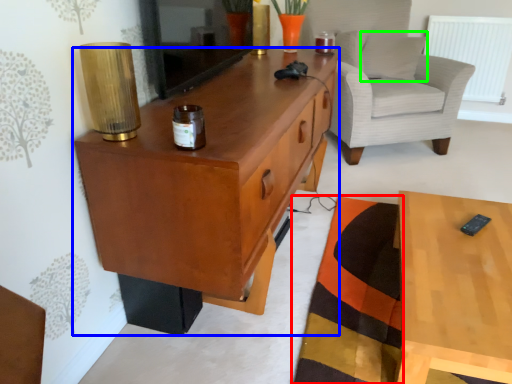
Question: Which object is the closest to the mat (highlighted by a red box)? Choose among these: cabinetry (highlighted by a blue box) or pillow (highlighted by a green box).

Choices:
 (A) cabinetry
 (B) pillow

Answer: (A)